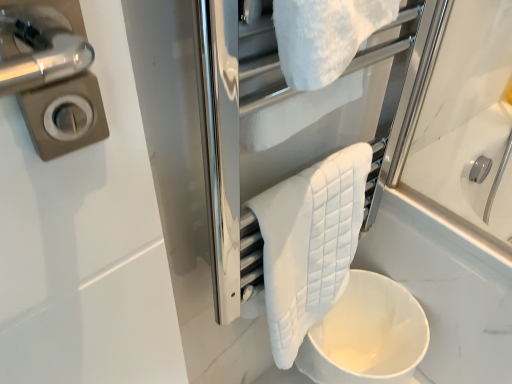
Describe the element at coordinates (268, 131) in the screenshot. The width and height of the screenshot is (512, 384). I see `white quilted towel at upper center` at that location.

I want to click on white quilted towel at center, so click(309, 243).

At what (x,y) coordinates should I click in order to perform the action: click on white quilted towel at upper center. Please return your answer as a coordinate pair (x, y). This screenshot has width=512, height=384. Looking at the image, I should click on (268, 131).

Considering the sizes of objects white matte toilet bowl at lower center and white quilted towel at center in the image provided, who is smaller, white matte toilet bowl at lower center or white quilted towel at center?

With smaller size is white quilted towel at center.

At what (x,y) coordinates should I click in order to perform the action: click on toilet bowl below the white quilted towel at center (from a real-world perspective). Please return your answer as a coordinate pair (x, y). This screenshot has height=384, width=512. Looking at the image, I should click on (367, 335).

Which of these two, white matte toilet bowl at lower center or white quilted towel at upper center, is thinner?

Thinner between the two is white quilted towel at upper center.

Which object is positioned more to the right, white matte toilet bowl at lower center or white quilted towel at upper center?

From the viewer's perspective, white matte toilet bowl at lower center appears more on the right side.

Find the location of a particular element. toilet bowl lying on the right of white quilted towel at upper center is located at coordinates (367, 335).

How different are the orientations of white quilted towel at upper center and white matte toilet bowl at lower center in degrees?

The facing directions of white quilted towel at upper center and white matte toilet bowl at lower center are 2.25 degrees apart.

Considering their positions, is white quilted towel at upper center located in front of or behind white matte toilet bowl at lower center?

white quilted towel at upper center is in front of white matte toilet bowl at lower center.

Are white quilted towel at upper center and white matte toilet bowl at lower center far apart?

white quilted towel at upper center is near white matte toilet bowl at lower center, not far away.

Is white quilted towel at upper center facing towards white quilted towel at center?

No.

What's the angular difference between white quilted towel at upper center and white quilted towel at center's facing directions?

They differ by 0.0025 degrees in their facing directions.

From the image's perspective, is white quilted towel at upper center below white quilted towel at center?

No, from the image's perspective, white quilted towel at upper center is not beneath white quilted towel at center.

Is white quilted towel at upper center inside the boundaries of white quilted towel at center, or outside?

white quilted towel at upper center is not inside white quilted towel at center, it's outside.

Between white quilted towel at center and white matte toilet bowl at lower center, which one appears on the right side from the viewer's perspective?

From the viewer's perspective, white matte toilet bowl at lower center appears more on the right side.

Which is in front, point (307, 186) or point (318, 366)?

The point (307, 186) is more forward.

Is the surface of white quilted towel at center in direct contact with white matte toilet bowl at lower center?

No, white quilted towel at center is not touching white matte toilet bowl at lower center.

I want to click on toilet bowl that appears on the right of white quilted towel at center, so click(x=367, y=335).

In the image, is white quilted towel at center positioned in front of or behind white quilted towel at upper center?

In the image, white quilted towel at center appears behind white quilted towel at upper center.

Where is `towel that is behind the white quilted towel at upper center`? The width and height of the screenshot is (512, 384). towel that is behind the white quilted towel at upper center is located at coordinates (309, 243).

What's the angular difference between white quilted towel at center and white quilted towel at upper center's facing directions?

white quilted towel at center and white quilted towel at upper center are facing 0.0025 degrees away from each other.

Where is `towel above the white matte toilet bowl at lower center (from a real-world perspective)`? towel above the white matte toilet bowl at lower center (from a real-world perspective) is located at coordinates (309, 243).

Identify the location of toilet bowl beneath the white quilted towel at upper center (from a real-world perspective). (367, 335).

In the scene shown: When comparing their distances from white quilted towel at center, does white quilted towel at upper center or white matte toilet bowl at lower center seem closer?

Among the two, white quilted towel at upper center is located nearer to white quilted towel at center.

Estimate the real-world distances between objects in this image. Which object is further from white quilted towel at upper center, white matte toilet bowl at lower center or white quilted towel at center?

Among the two, white matte toilet bowl at lower center is located further to white quilted towel at upper center.

Based on their spatial positions, is white quilted towel at center or white quilted towel at upper center closer to white matte toilet bowl at lower center?

white quilted towel at center is positioned closer to the anchor white matte toilet bowl at lower center.

Looking at the image, which one is located closer to white matte toilet bowl at lower center, white quilted towel at upper center or white quilted towel at center?

Based on the image, white quilted towel at center appears to be nearer to white matte toilet bowl at lower center.

Which object lies nearer to the anchor point white quilted towel at center, white matte toilet bowl at lower center or white quilted towel at upper center?

white quilted towel at upper center is closer to white quilted towel at center.

Considering their positions, is white quilted towel at center positioned closer to white quilted towel at upper center than white matte toilet bowl at lower center?

Based on the image, white quilted towel at center appears to be nearer to white quilted towel at upper center.

Locate an element on the screen. towel between white quilted towel at upper center and white matte toilet bowl at lower center vertically is located at coordinates (309, 243).